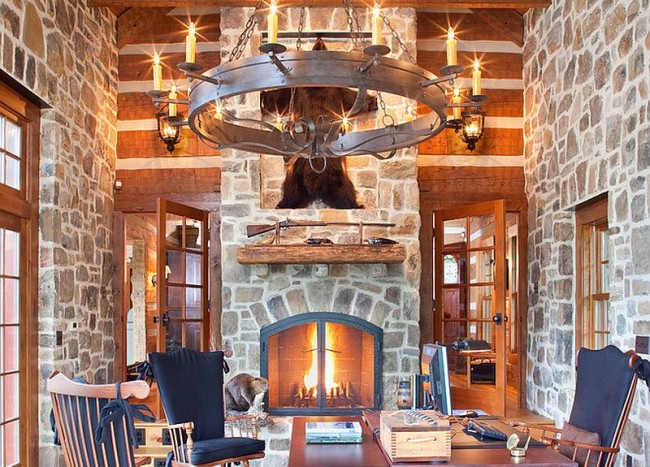
Where is `large hanging candelabra`? large hanging candelabra is located at coordinates (344, 75).